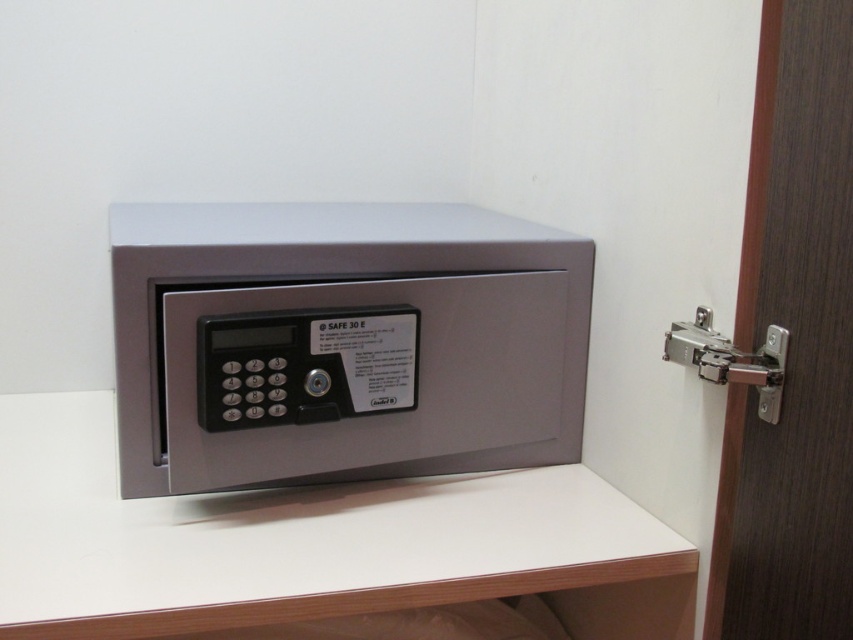
From the picture: Is satin metallic safe at center thinner than silver metallic hinge at right?

No, satin metallic safe at center is not thinner than silver metallic hinge at right.

Image resolution: width=853 pixels, height=640 pixels. Describe the element at coordinates (341, 342) in the screenshot. I see `satin metallic safe at center` at that location.

The height and width of the screenshot is (640, 853). I want to click on satin metallic safe at center, so click(x=341, y=342).

Is satin metallic safe at center to the right of dark brown wood door at right from the viewer's perspective?

Incorrect, satin metallic safe at center is not on the right side of dark brown wood door at right.

Is satin metallic safe at center bigger than dark brown wood door at right?

Yes.

Is point (480, 257) closer to viewer compared to point (782, 20)?

That is False.

Identify the location of satin metallic safe at center. (341, 342).

Does dark brown wood door at right have a greater width compared to silver metallic hinge at right?

In fact, dark brown wood door at right might be narrower than silver metallic hinge at right.

Is dark brown wood door at right above silver metallic hinge at right?

Actually, dark brown wood door at right is below silver metallic hinge at right.

This screenshot has height=640, width=853. I want to click on dark brown wood door at right, so click(792, 346).